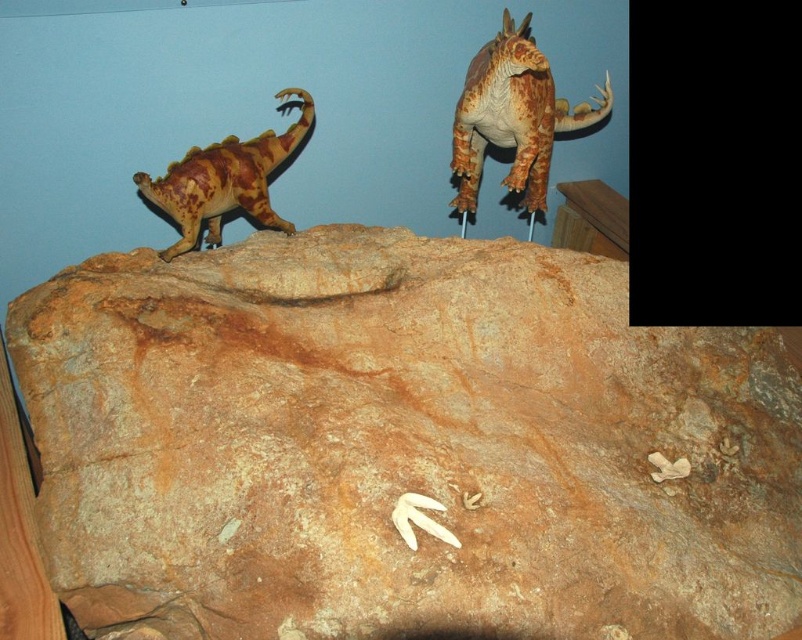
Who is more distant from viewer, (508, 113) or (277, 134)?

Point (277, 134)

Does rusty metallic dinosaur at upper right have a smaller size compared to rustic wood dinosaur at left?

Incorrect, rusty metallic dinosaur at upper right is not smaller in size than rustic wood dinosaur at left.

Is point (454, 204) positioned before point (282, 224)?

No.

Where is `rusty metallic dinosaur at upper right`? This screenshot has width=802, height=640. rusty metallic dinosaur at upper right is located at coordinates (513, 116).

Is brown rough rock at center smaller than rusty metallic dinosaur at upper right?

Actually, brown rough rock at center might be larger than rusty metallic dinosaur at upper right.

Who is more distant from viewer, (136, 380) or (466, 179)?

Point (466, 179)

At what (x,y) coordinates should I click in order to perform the action: click on brown rough rock at center. Please return your answer as a coordinate pair (x, y). The height and width of the screenshot is (640, 802). Looking at the image, I should click on (402, 444).

Is brown rough rock at center closer to camera compared to rustic wood dinosaur at left?

Yes, brown rough rock at center is in front of rustic wood dinosaur at left.

Is brown rough rock at center to the left of rustic wood dinosaur at left from the viewer's perspective?

In fact, brown rough rock at center is to the right of rustic wood dinosaur at left.

Which is in front, point (691, 440) or point (181, 156)?

Point (691, 440)

Where is `brown rough rock at center`? The height and width of the screenshot is (640, 802). brown rough rock at center is located at coordinates (402, 444).